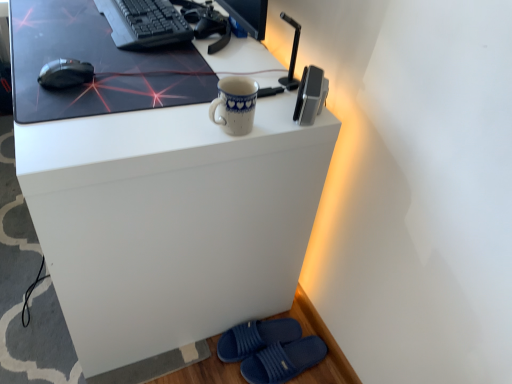
You are a GUI agent. You are given a task and a screenshot of the screen. Output one action in this format:
    pyautogui.click(x=<x>, y=<y>)
    Task: Click on the vacant space behind black matte mouse at left
    The width and height of the screenshot is (512, 384).
    Given the screenshot: What is the action you would take?
    pyautogui.click(x=91, y=47)